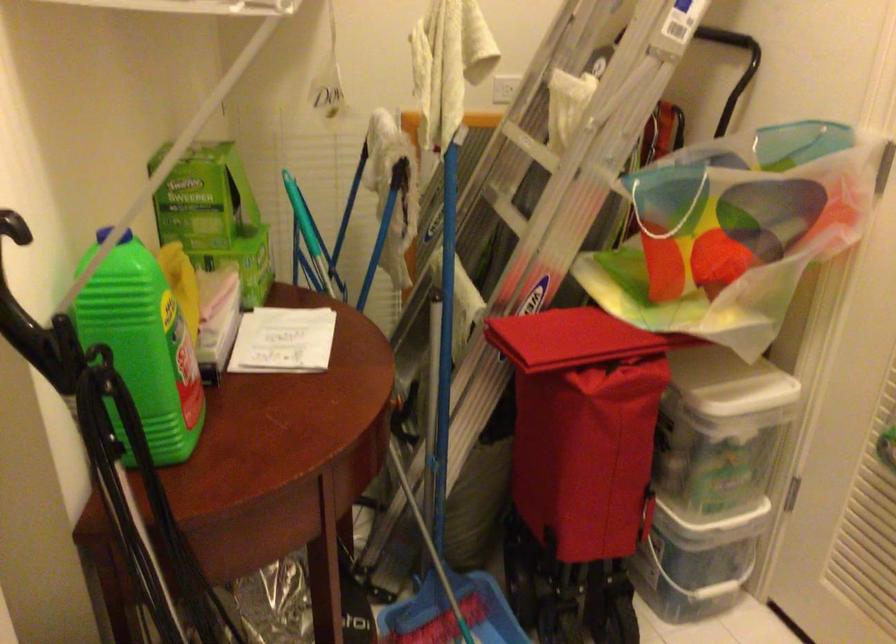
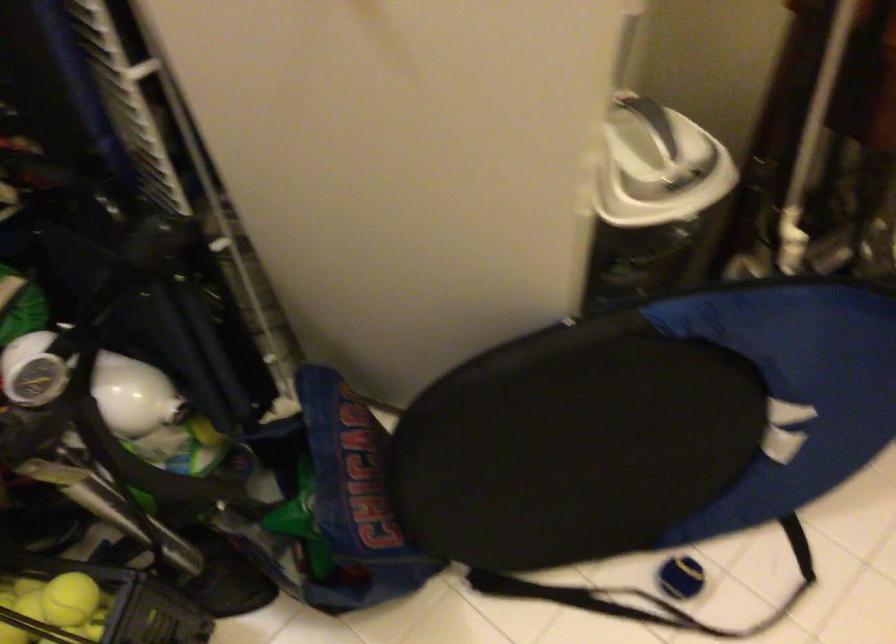
The images are taken continuously from a first-person perspective. In which direction is your viewpoint rotating?

The camera's rotation is toward left-down.